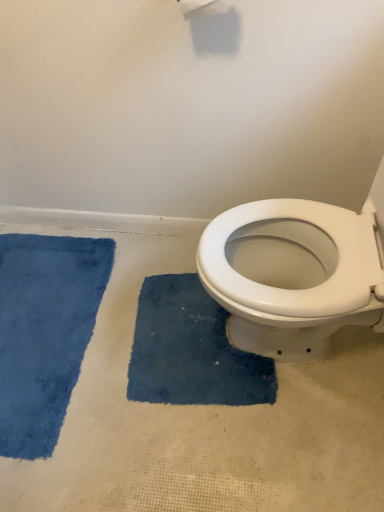
Where is `vacant space situated above blue plush bath mat at left, which ranks as the first bath mat in left-to-right order (from a real-world perspective)`? vacant space situated above blue plush bath mat at left, which ranks as the first bath mat in left-to-right order (from a real-world perspective) is located at coordinates (48, 307).